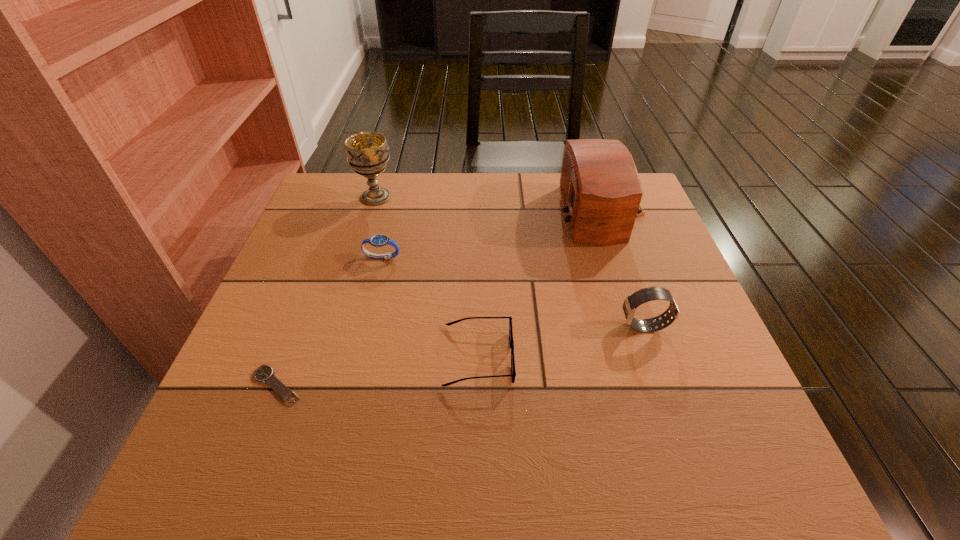
You are a GUI agent. You are given a task and a screenshot of the screen. Output one action in this format:
    pyautogui.click(x=<x>, y=<y>)
    Task: Click on the vacant area that satisfies the following two spatial constraints: 1. on the front-facing side of the radio receiver; 2. on the front side of the nearest watch
    The width and height of the screenshot is (960, 540).
    Given the screenshot: What is the action you would take?
    pyautogui.click(x=659, y=386)

Find the location of `free space that satisfies the following two spatial constraints: 1. on the front-facing side of the fifth tallest object; 2. on the front side of the nearest watch`. free space that satisfies the following two spatial constraints: 1. on the front-facing side of the fifth tallest object; 2. on the front side of the nearest watch is located at coordinates (478, 386).